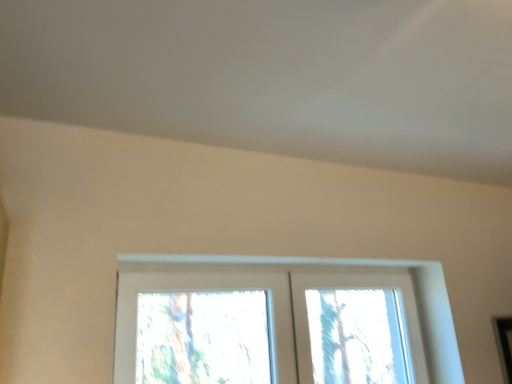
Image resolution: width=512 pixels, height=384 pixels. What do you see at coordinates (296, 304) in the screenshot? I see `clear glass window at center` at bounding box center [296, 304].

Where is `clear glass window at center`? clear glass window at center is located at coordinates (296, 304).

Locate an element on the screen. This screenshot has width=512, height=384. clear glass window at center is located at coordinates (296, 304).